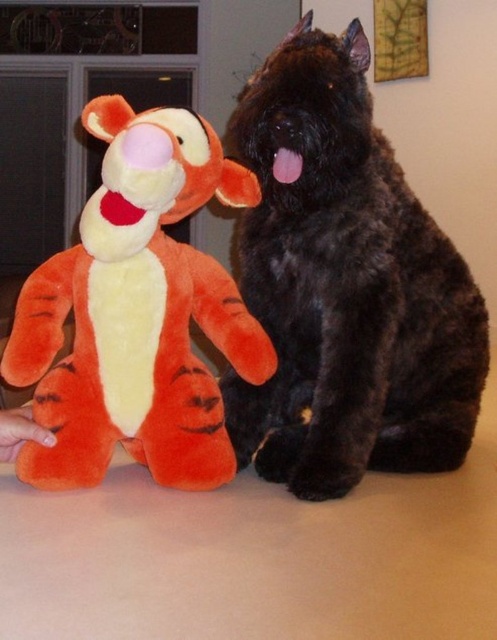
Question: Does black furry dog at center appear on the left side of orange plush toy at left?

Choices:
 (A) no
 (B) yes

Answer: (A)

Question: Does black furry dog at center appear on the right side of orange plush toy at left?

Choices:
 (A) no
 (B) yes

Answer: (B)

Question: Which object appears farthest from the camera in this image?

Choices:
 (A) orange plush toy at left
 (B) black furry dog at center

Answer: (B)

Question: Can you confirm if black furry dog at center is positioned above orange plush toy at left?

Choices:
 (A) yes
 (B) no

Answer: (A)

Question: Which object appears closest to the camera in this image?

Choices:
 (A) black furry dog at center
 (B) orange plush toy at left

Answer: (B)